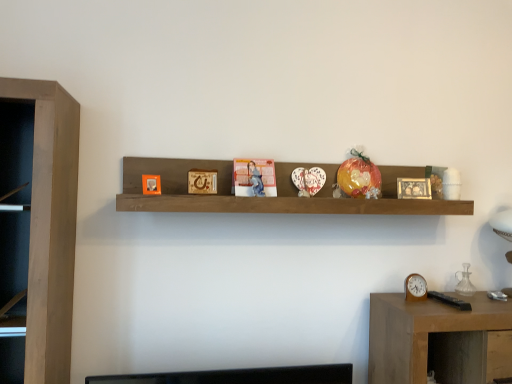
Question: Is the position of woodenmaterial/texturepicture frame at center, which ranks as the 2th picture frame in left-to-right order, more distant than that of wooden table at lower right?

Choices:
 (A) yes
 (B) no

Answer: (A)

Question: Is woodenmaterial/texturepicture frame at center, which ranks as the 2th picture frame in left-to-right order, completely or partially outside of wooden table at lower right?

Choices:
 (A) yes
 (B) no

Answer: (A)

Question: Can you confirm if woodenmaterial/texturepicture frame at center, the second picture frame positioned from the front, is smaller than wooden table at lower right?

Choices:
 (A) no
 (B) yes

Answer: (B)

Question: Is woodenmaterial/texturepicture frame at center, the second picture frame in the back-to-front sequence, at the left side of wooden table at lower right?

Choices:
 (A) yes
 (B) no

Answer: (A)

Question: Considering the relative sizes of woodenmaterial/texturepicture frame at center, the second picture frame in the back-to-front sequence, and wooden table at lower right in the image provided, is woodenmaterial/texturepicture frame at center, the second picture frame in the back-to-front sequence, bigger than wooden table at lower right?

Choices:
 (A) yes
 (B) no

Answer: (B)

Question: From a real-world perspective, does woodenmaterial/texturepicture frame at center, which ranks as the 2th picture frame in left-to-right order, stand above wooden table at lower right?

Choices:
 (A) yes
 (B) no

Answer: (A)

Question: Is orange matte picture frame at upper center, which ranks as the third picture frame in back-to-front order, taller than woodenmaterial/texturepicture frame at center, which ranks as the 2th picture frame in left-to-right order?

Choices:
 (A) no
 (B) yes

Answer: (A)

Question: Is orange matte picture frame at upper center, placed as the 1th picture frame when sorted from left to right, wider than woodenmaterial/texturepicture frame at center, which ranks as the 2th picture frame in left-to-right order?

Choices:
 (A) yes
 (B) no

Answer: (A)

Question: Is orange matte picture frame at upper center, positioned as the 1th picture frame in front-to-back order, behind woodenmaterial/texturepicture frame at center, the second picture frame in the back-to-front sequence?

Choices:
 (A) yes
 (B) no

Answer: (B)

Question: Is orange matte picture frame at upper center, which is the third picture frame in right-to-left order, thinner than woodenmaterial/texturepicture frame at center, the second picture frame in the back-to-front sequence?

Choices:
 (A) no
 (B) yes

Answer: (A)

Question: Considering the relative sizes of orange matte picture frame at upper center, placed as the 1th picture frame when sorted from left to right, and woodenmaterial/texturepicture frame at center, the second picture frame in the back-to-front sequence, in the image provided, is orange matte picture frame at upper center, placed as the 1th picture frame when sorted from left to right, shorter than woodenmaterial/texturepicture frame at center, the second picture frame in the back-to-front sequence,?

Choices:
 (A) yes
 (B) no

Answer: (A)

Question: From a real-world perspective, is orange matte picture frame at upper center, positioned as the 1th picture frame in front-to-back order, located higher than woodenmaterial/texturepicture frame at center, the second picture frame in the right-to-left sequence?

Choices:
 (A) no
 (B) yes

Answer: (A)

Question: Can you confirm if wooden clock at right is thinner than wooden shelf at center?

Choices:
 (A) no
 (B) yes

Answer: (B)